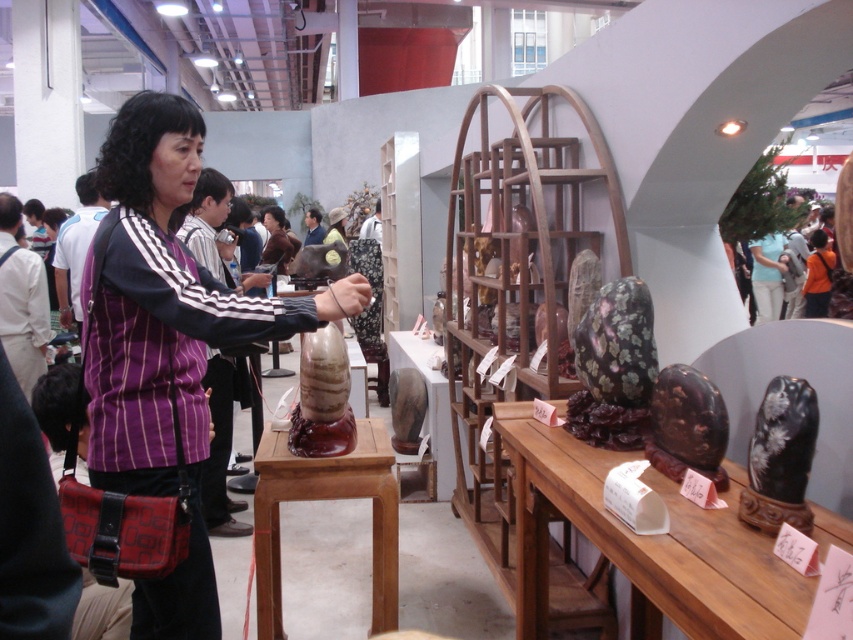
Is purple striped shirt at center positioned behind brown polished wood stool at center?

No, it is not.

Find the location of a particular element. purple striped shirt at center is located at coordinates click(167, 340).

Between point (183, 266) and point (395, 518), which one is positioned in front?

Positioned in front is point (183, 266).

I want to click on purple striped shirt at center, so click(167, 340).